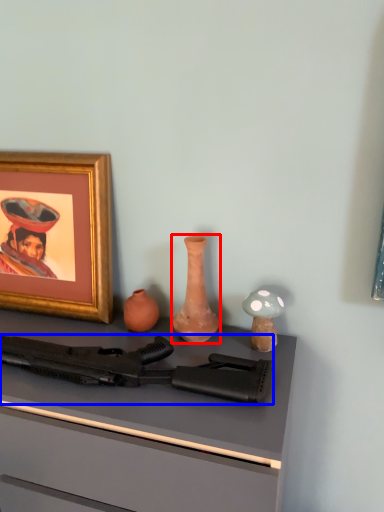
Question: Which point is closer to the camera, vase (highlighted by a red box) or rifle (highlighted by a blue box)?

Choices:
 (A) vase
 (B) rifle

Answer: (B)